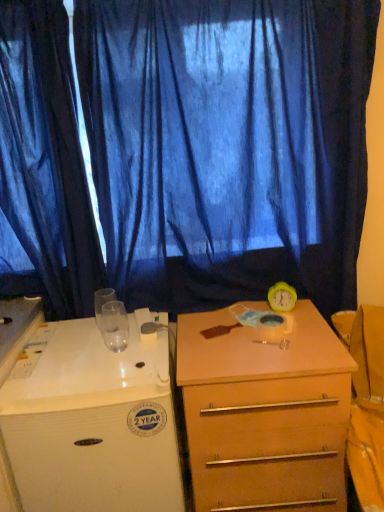
Question: Do you think blue sheer curtain at left, which is counted as the first curtain, starting from the left, is within light brown wood drawer at center, or outside of it?

Choices:
 (A) inside
 (B) outside

Answer: (B)

Question: Based on their positions, is blue sheer curtain at left, which appears as the second curtain when viewed from the right, located to the left or right of light brown wood drawer at center?

Choices:
 (A) left
 (B) right

Answer: (A)

Question: Which is farther from the white glossy desk at left?

Choices:
 (A) blue sheer curtain at left, which appears as the second curtain when viewed from the right
 (B) light brown wood drawer at center
 (C) blue sheer curtain at upper center, which is the second curtain in left-to-right order

Answer: (C)

Question: Estimate the real-world distances between objects in this image. Which object is closer to the blue sheer curtain at left, which is counted as the first curtain, starting from the left?

Choices:
 (A) blue sheer curtain at upper center, the first curtain in the right-to-left sequence
 (B) white glossy desk at left
 (C) light brown wood drawer at center

Answer: (A)